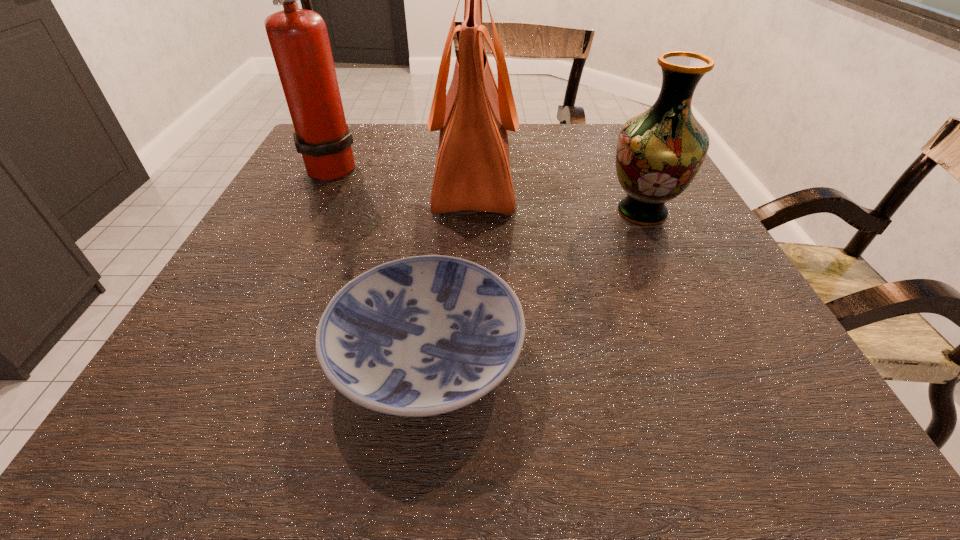
What are the coordinates of `fire extinguisher present at the far edge` in the screenshot? It's located at (x=298, y=38).

You are a GUI agent. You are given a task and a screenshot of the screen. Output one action in this format:
    pyautogui.click(x=<x>, y=<y>)
    Task: Click on the shopping bag situated at the far edge
    Image resolution: width=960 pixels, height=540 pixels.
    Given the screenshot: What is the action you would take?
    472,172

The image size is (960, 540). Find the location of `object that is at the near edge`. object that is at the near edge is located at coordinates (425, 335).

The width and height of the screenshot is (960, 540). I want to click on object located in the left edge section of the desktop, so click(298, 38).

You are a GUI agent. You are given a task and a screenshot of the screen. Output one action in this format:
    pyautogui.click(x=<x>, y=<y>)
    Task: Click on the object that is at the right edge
    Image resolution: width=960 pixels, height=540 pixels.
    Given the screenshot: What is the action you would take?
    pyautogui.click(x=659, y=152)

This screenshot has height=540, width=960. What are the coordinates of `object that is at the far left corner` in the screenshot? It's located at (298, 38).

The image size is (960, 540). I want to click on vacant space at the far edge of the desktop, so click(x=375, y=138).

In the image, there is a desktop. At what (x,y) coordinates should I click in order to perform the action: click on blank space at the near edge. Please return your answer as a coordinate pair (x, y). Image resolution: width=960 pixels, height=540 pixels. Looking at the image, I should click on (562, 420).

In the image, there is a desktop. What are the coordinates of `vacant space at the left edge` in the screenshot? It's located at (226, 269).

Where is `blank space at the right edge of the desktop`? The width and height of the screenshot is (960, 540). blank space at the right edge of the desktop is located at coordinates (711, 266).